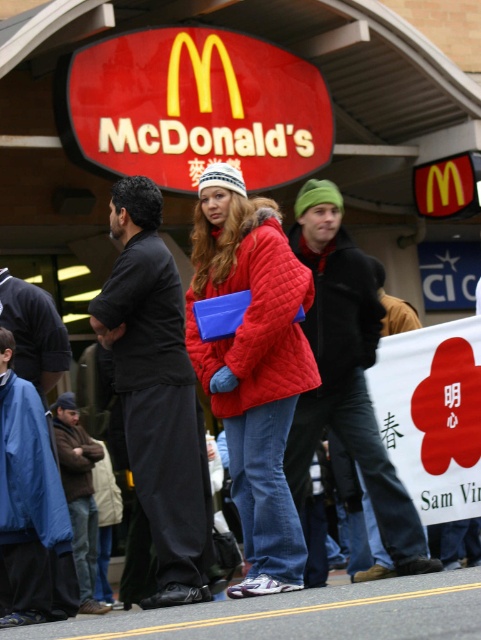
Can you confirm if black matte shirt at center is shorter than green knit hat at center?

No.

Who is taller, black matte shirt at center or green knit hat at center?

black matte shirt at center is taller.

Which is behind, point (131, 406) or point (341, 196)?

Positioned behind is point (341, 196).

What are the coordinates of `black matte shirt at center` in the screenshot? It's located at (155, 404).

Is black matte shirt at center to the left of brown woolen jacket at lower left from the viewer's perspective?

In fact, black matte shirt at center is to the right of brown woolen jacket at lower left.

Can you confirm if black matte shirt at center is wider than brown woolen jacket at lower left?

No.

Is point (105, 282) farther from viewer compared to point (88, 444)?

Yes, point (105, 282) is farther from viewer.

The image size is (481, 640). Identify the location of black matte shirt at center. (155, 404).

Find the location of a particular element. Image resolution: width=481 pixels, height=640 pixels. green knit hat at center is located at coordinates (345, 371).

Where is `green knit hat at center`? The width and height of the screenshot is (481, 640). green knit hat at center is located at coordinates (345, 371).

This screenshot has width=481, height=640. Find the location of `green knit hat at center`. green knit hat at center is located at coordinates (345, 371).